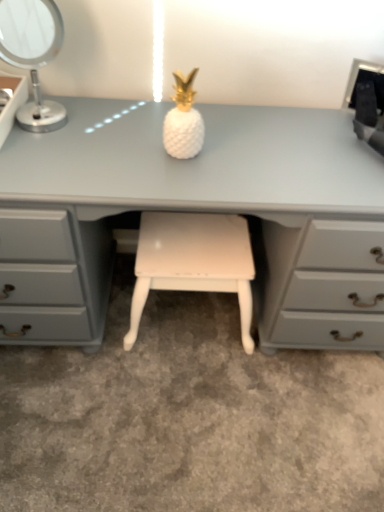
You are a GUI agent. You are given a task and a screenshot of the screen. Output one action in this format:
    pyautogui.click(x=<x>, y=<y>)
    Task: Click on the free space that is in between white glossy pineapple at center and black plastic desktop computer at upper right
    The width and height of the screenshot is (384, 512).
    Given the screenshot: What is the action you would take?
    pyautogui.click(x=276, y=135)